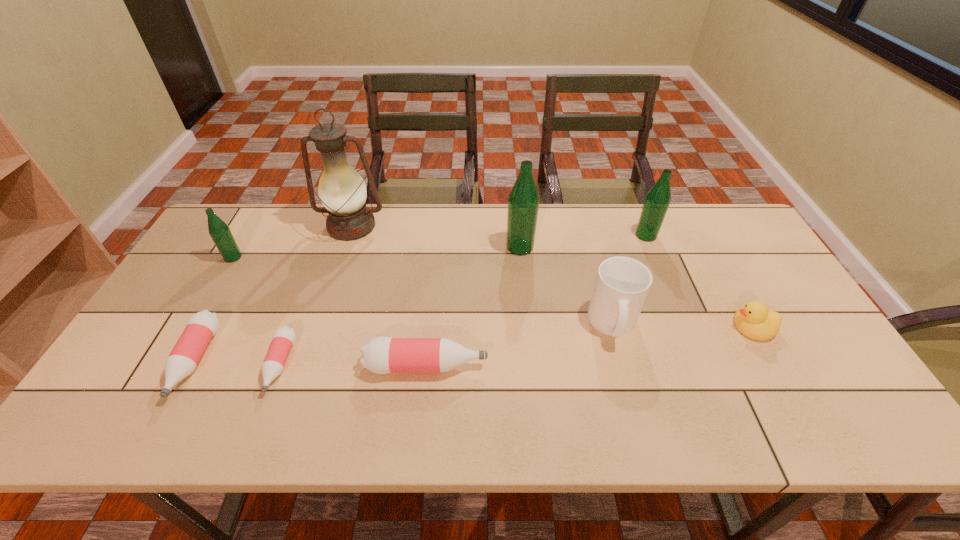
Point out which green bottle is positioned as the second nearest to the second object from right to left. Please provide its 2D coordinates. Your answer should be formatted as a tuple, i.e. [(x, y)], where the tuple contains the x and y coordinates of a point satisfying the conditions above.

[(219, 231)]

The height and width of the screenshot is (540, 960). Find the location of `the closest pink bottle to the shortest object`. the closest pink bottle to the shortest object is located at coordinates (202, 326).

Point out which pink bottle is positioned as the second nearest to the duckling. Please provide its 2D coordinates. Your answer should be formatted as a tuple, i.e. [(x, y)], where the tuple contains the x and y coordinates of a point satisfying the conditions above.

[(283, 338)]